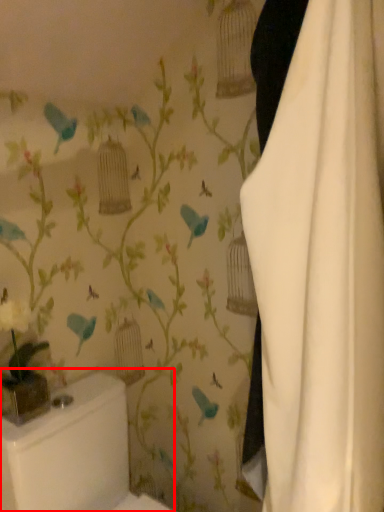
Question: From the image's perspective, where is toilet bowl (annotated by the red box) located in relation to curtain in the image?

Choices:
 (A) below
 (B) above

Answer: (A)